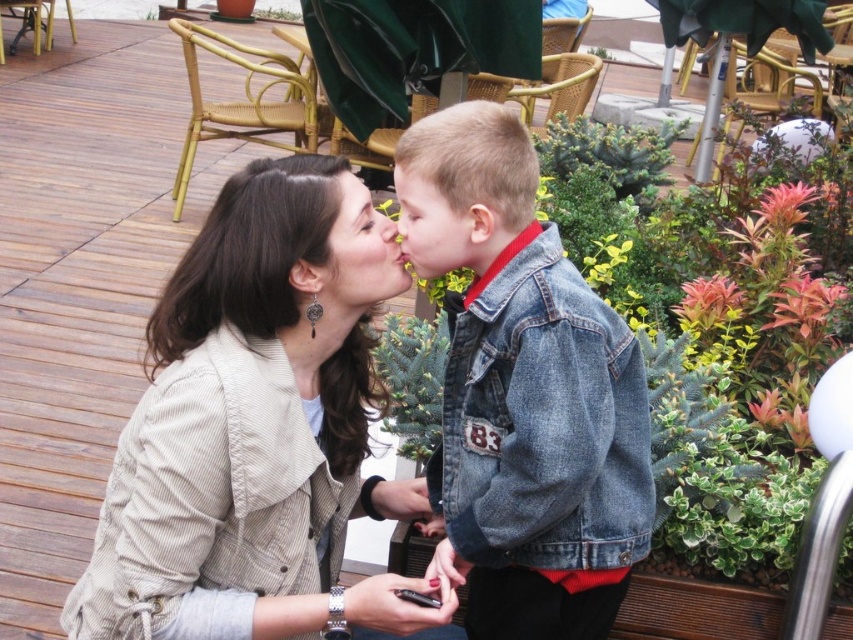
You are a photographer trying to capture the scene between the denim jacket at center and the matte skin at center. Based on their positions, which object is on the right side?

The denim jacket at center is positioned on the right side of matte skin at center.

You are a photographer trying to capture a closeup of the smooth skin face at center and the matte skin at center in the image. Which one should you focus on first to ensure it is in sharp focus?

The smooth skin face at center is behind matte skin at center, so you should focus on the matte skin at center first to ensure it is in sharp focus.